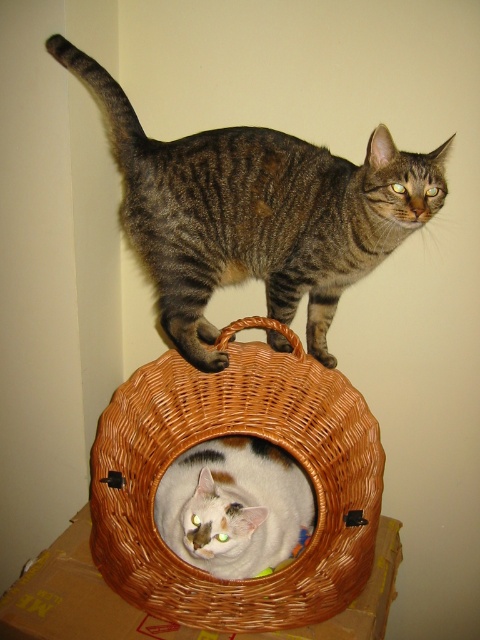
Question: Which of the following is the closest to the observer?

Choices:
 (A) white fur cat at center
 (B) tabby fur cat at upper center

Answer: (A)

Question: From the image, what is the correct spatial relationship of tabby fur cat at upper center in relation to woven brown basket at center?

Choices:
 (A) above
 (B) below

Answer: (A)

Question: Does tabby fur cat at upper center have a lesser width compared to woven brown basket at center?

Choices:
 (A) yes
 (B) no

Answer: (B)

Question: Which point is farther from the camera taking this photo?

Choices:
 (A) (347, 480)
 (B) (301, 144)

Answer: (A)

Question: Is tabby fur cat at upper center positioned before woven brown basket at center?

Choices:
 (A) no
 (B) yes

Answer: (A)

Question: Which point is closer to the camera?

Choices:
 (A) tabby fur cat at upper center
 (B) white fur cat at center

Answer: (B)